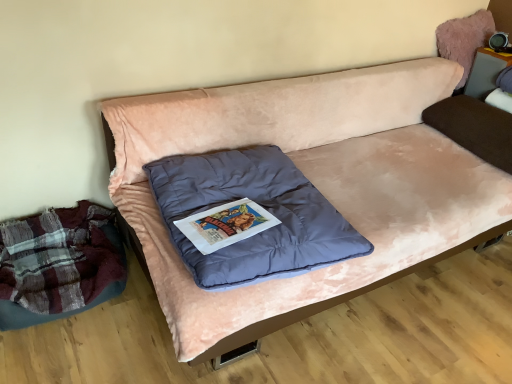
Question: From the image's perspective, is brown velvety pillow at right, the second pillow in the left-to-right sequence, above or below plaid fabric mattress at lower left?

Choices:
 (A) above
 (B) below

Answer: (A)

Question: Is point (457, 135) closer or farther from the camera than point (110, 225)?

Choices:
 (A) closer
 (B) farther

Answer: (B)

Question: Which object is the closest to the velvet pink couch at center?

Choices:
 (A) fuzzy pink bean bag at upper right
 (B) plaid fabric mattress at lower left
 (C) velvet blue pillow at center, which ranks as the first pillow in left-to-right order
 (D) brown velvety pillow at right, the second pillow in the left-to-right sequence
 (E) matte gray speaker at upper right

Answer: (C)

Question: Based on their relative distances, which object is farther from the velvet blue pillow at center, marked as the second pillow in a back-to-front arrangement?

Choices:
 (A) fuzzy pink bean bag at upper right
 (B) brown velvety pillow at right, arranged as the 1th pillow when viewed from the right
 (C) velvet pink couch at center
 (D) matte gray speaker at upper right
 (E) plaid fabric mattress at lower left

Answer: (D)